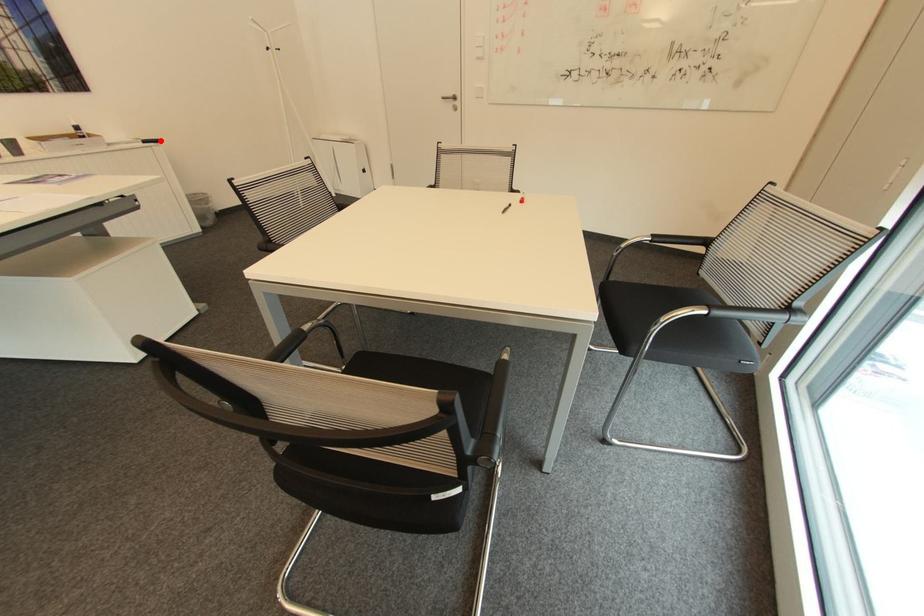
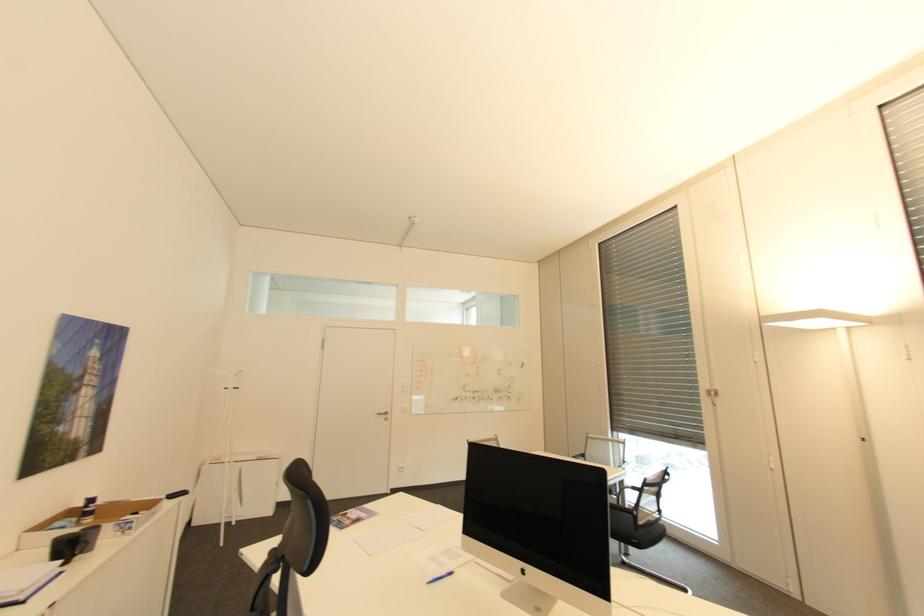
The point at the highlighted location is marked in the first image. Where is the corresponding point in the second image?

(188, 493)